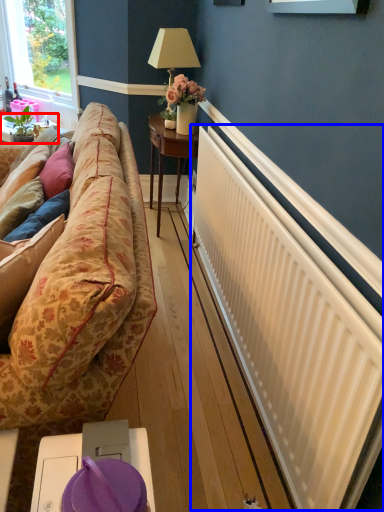
Question: Which of the following is the farthest to the observer, table (highlighted by a red box) or radiator (highlighted by a blue box)?

Choices:
 (A) table
 (B) radiator

Answer: (A)